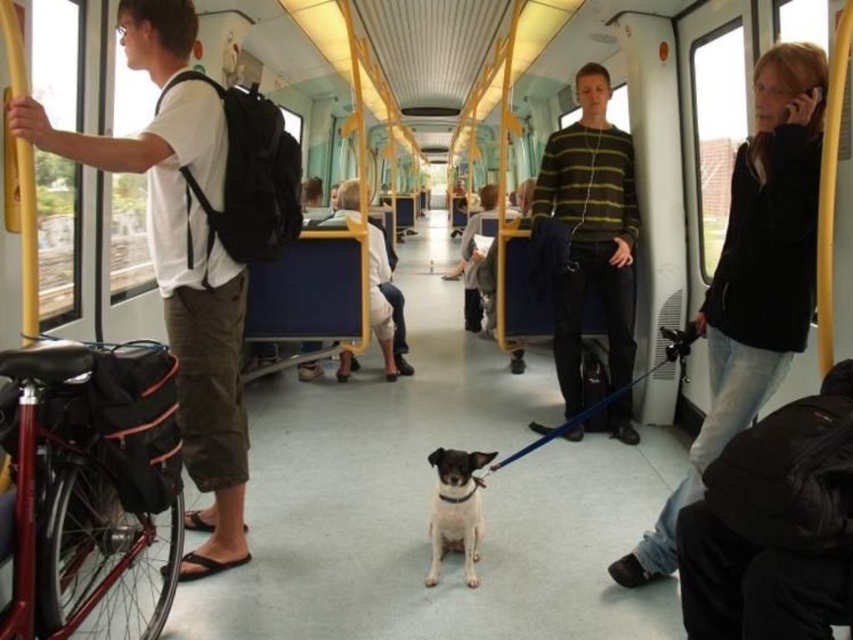
You are a passenger on the train and you want to move from the window to the exit door located at the back of the train. There is a black leather jacket at upper right and a white smooth dog at center in your way. Which object is closer to your current position so you can navigate around it?

The white smooth dog at center is closer to your current position because the black leather jacket at upper right is positioned on the right side of it, meaning the dog is between you and the window.

You are a passenger on the train and want to pet the white smooth dog at center. The black leather jacket at upper right is blocking your path. Can you reach the dog without moving the jacket?

The black leather jacket at upper right is in front of the white smooth dog at center, so you cannot reach the dog without moving the jacket.